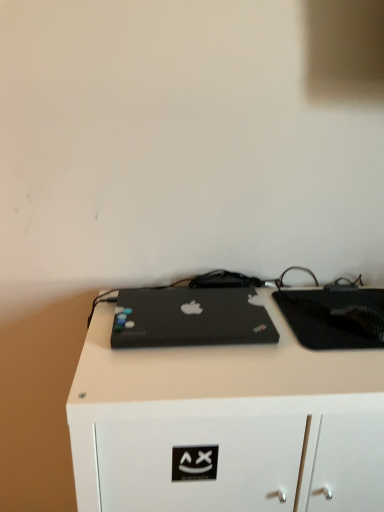
Question: From the image's perspective, is black matte desk at center above or below black matte tablet at center?

Choices:
 (A) above
 (B) below

Answer: (B)

Question: In the image, is black matte desk at center on the left side or the right side of black matte tablet at center?

Choices:
 (A) right
 (B) left

Answer: (B)

Question: Which is farther from the black matte laptop at center?

Choices:
 (A) black matte tablet at center
 (B) black matte desk at center

Answer: (A)

Question: Based on their relative distances, which object is nearer to the black matte tablet at center?

Choices:
 (A) black matte laptop at center
 (B) black matte desk at center

Answer: (A)